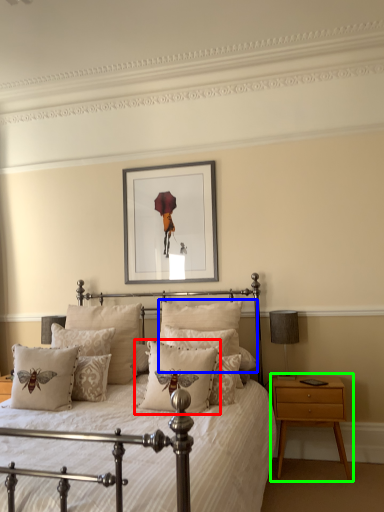
Question: Which object is positioned closest to pillow (highlighted by a red box)? Select from pillow (highlighted by a blue box) and nightstand (highlighted by a green box).

Choices:
 (A) pillow
 (B) nightstand

Answer: (A)